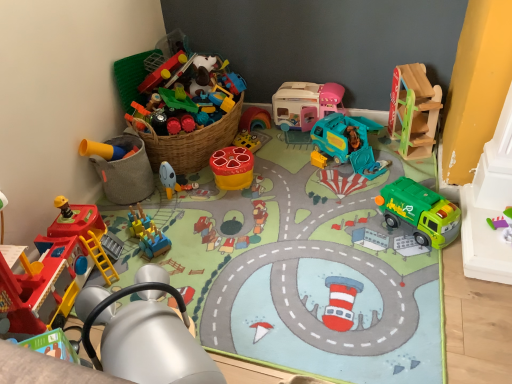
Where is `free space between green plastic garbage truck at lower right, which appears as the second toy when viewed from the right, and matte plastic toy at center, which is the 3th toy in left-to-right order`? free space between green plastic garbage truck at lower right, which appears as the second toy when viewed from the right, and matte plastic toy at center, which is the 3th toy in left-to-right order is located at coordinates (303, 211).